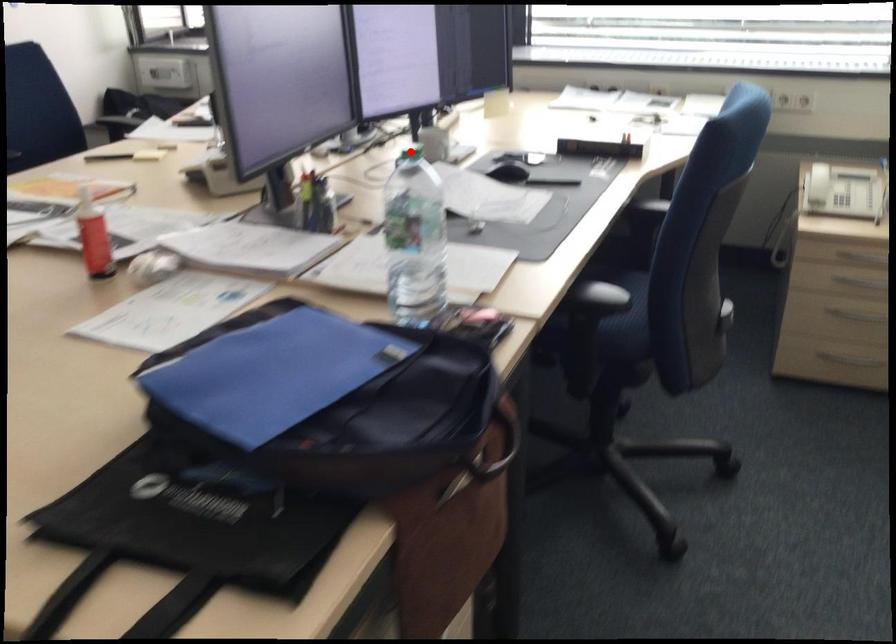
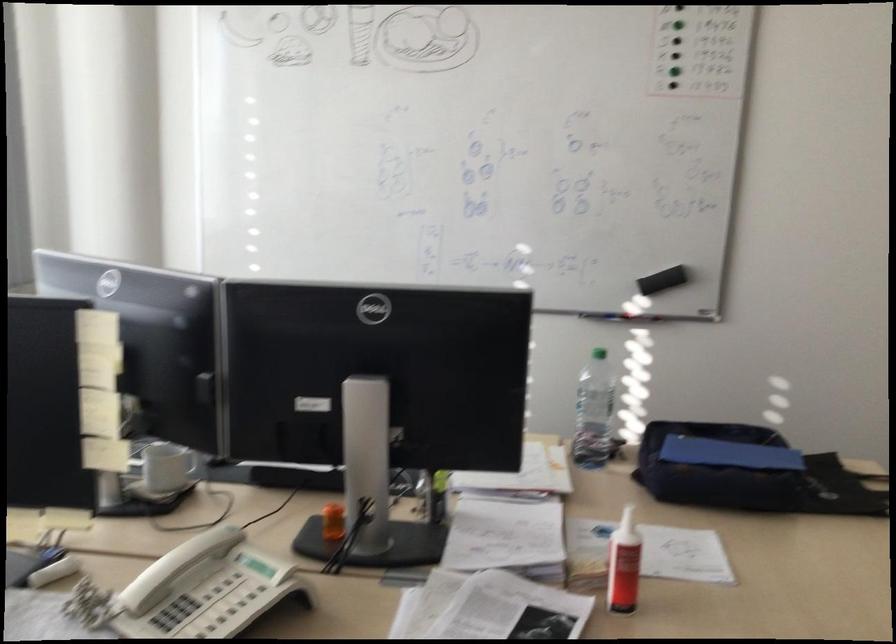
Question: I am providing you with two images of the same scene from different viewpoints. A red point is marked on the first image. Can you still see the location of the red point in image 2?

Choices:
 (A) Yes
 (B) No

Answer: (B)